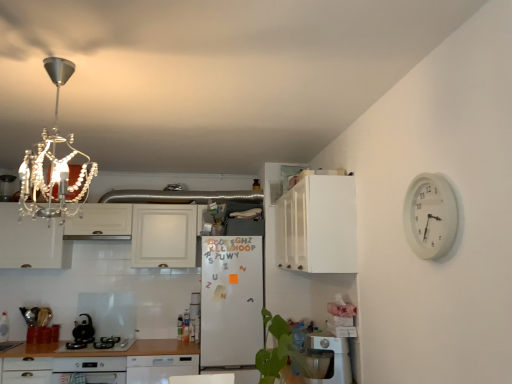
The width and height of the screenshot is (512, 384). In order to click on blank space situated above white plastic dish washer at lower center, arranged as the first dish washer when viewed from the top (from a real-world perspective) in this screenshot , I will do `click(327, 333)`.